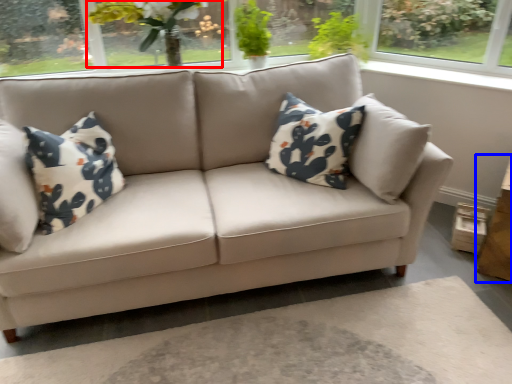
Question: Which of the following is the closest to the observer, floral arrangement (highlighted by a red box) or table (highlighted by a blue box)?

Choices:
 (A) floral arrangement
 (B) table

Answer: (B)